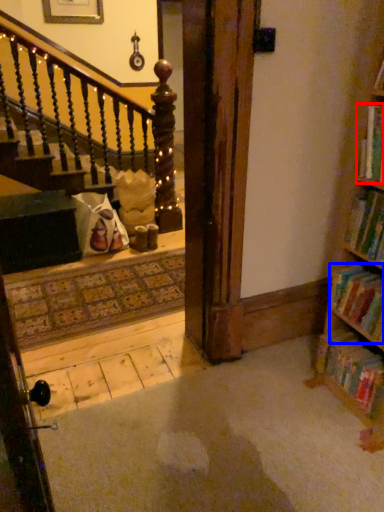
Question: Which point is further to the camera, book (highlighted by a red box) or book (highlighted by a blue box)?

Choices:
 (A) book
 (B) book

Answer: (B)